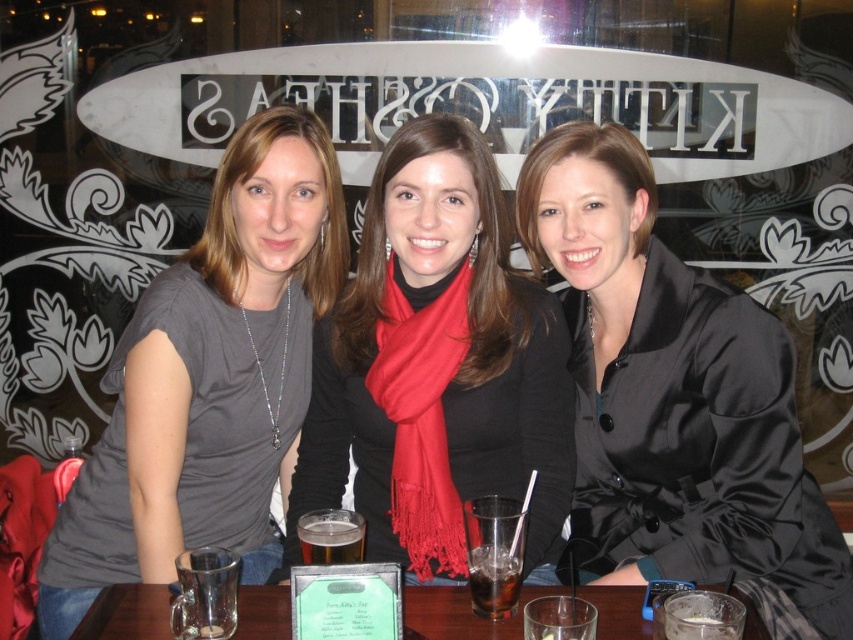
Question: Which is nearer to the clear glass table at center?

Choices:
 (A) matte gray shirt at center
 (B) translucent glass beer at center
 (C) matte black scarf at center
 (D) satin black coat at center

Answer: (B)

Question: Does matte gray shirt at center appear on the right side of translucent glass beer at center?

Choices:
 (A) yes
 (B) no

Answer: (B)

Question: Does matte black scarf at center appear under dark brown liquid at center?

Choices:
 (A) no
 (B) yes

Answer: (A)

Question: Does matte gray shirt at center appear under translucent glass beer at center?

Choices:
 (A) yes
 (B) no

Answer: (B)

Question: Based on their relative distances, which object is farther from the dark brown liquid at center?

Choices:
 (A) satin black coat at center
 (B) matte gray shirt at center
 (C) clear glass table at center

Answer: (B)

Question: Among these points, which one is farthest from the camera?

Choices:
 (A) (355, 291)
 (B) (235, 205)
 (C) (434, 637)
 (D) (752, 515)

Answer: (A)